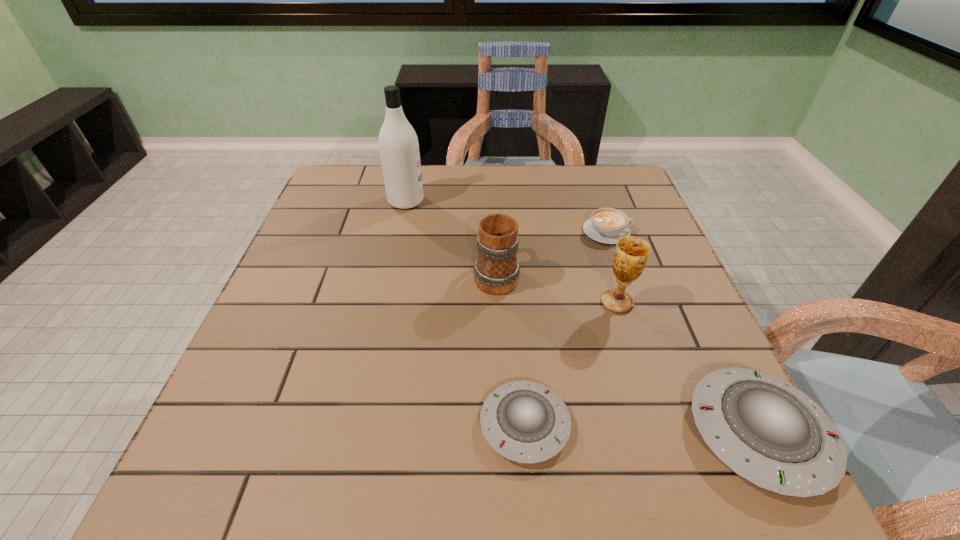
Please show where to add a saucer on the left while keeping spacing even. Please provide its 2D coordinates. Your answer should be formatted as a tuple, i.e. [(x, y)], where the tuple contains the x and y coordinates of a point satisfying the conditions above.

[(298, 416)]